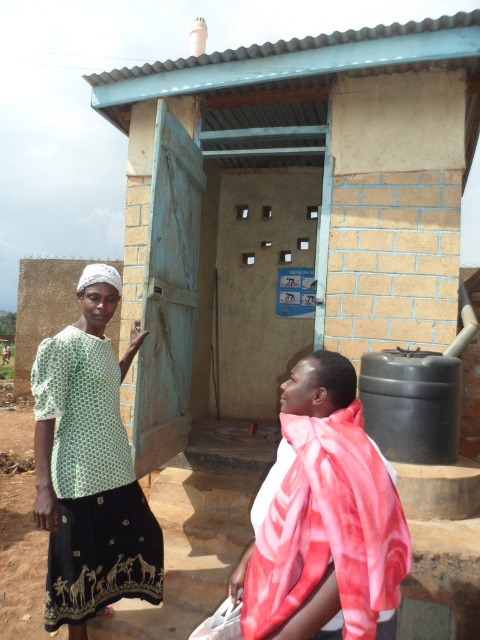
You are standing in front of the latrine and notice a green dotted blouse at center and a floral silk scarf at lower right. Which item is closer to you?

The green dotted blouse at center is closer to you because it is further to the viewer than the floral silk scarf at lower right.

You are a photographer taking a picture of the green dotted blouse at center and the floral silk scarf at lower right. Which object should you focus on first if you want to capture both in the frame without moving the camera?

The green dotted blouse at center is much taller than the floral silk scarf at lower right, so focusing on the green dotted blouse at center first will ensure it fits properly in the frame while still including the smaller floral silk scarf at lower right.

Based on the photo, you are a tailor who needs to measure the distance between the green dotted blouse at center and the floral silk scarf at lower right to decide if they can be placed together on a 4 feet wide shelf. Can they fit side by side?

The green dotted blouse at center and floral silk scarf at lower right are 4.56 feet apart from each other. Since the shelf is only 4 feet wide, they cannot fit side by side as the total width required is greater than the shelf width.